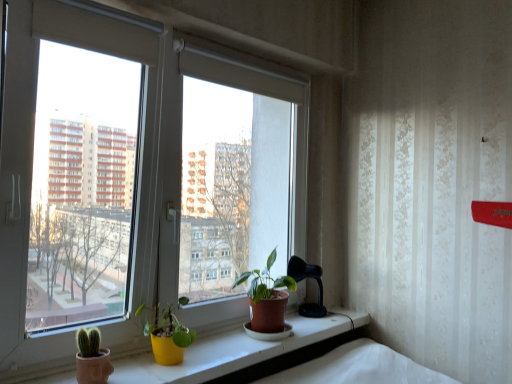
Where is `vacant space to the right of yellow matte pot at lower center, the 1th houseplant when ordered from left to right`? Image resolution: width=512 pixels, height=384 pixels. vacant space to the right of yellow matte pot at lower center, the 1th houseplant when ordered from left to right is located at coordinates (215, 357).